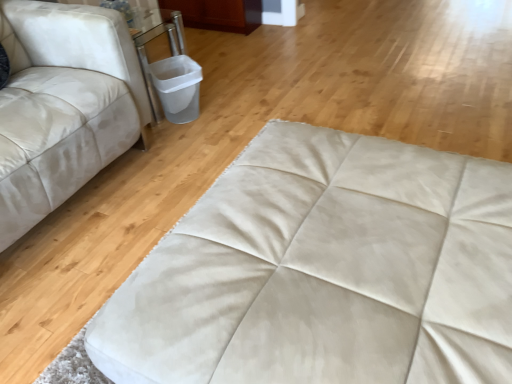
This screenshot has height=384, width=512. I want to click on blank space situated above beige suede ottoman at center (from a real-world perspective), so click(x=365, y=287).